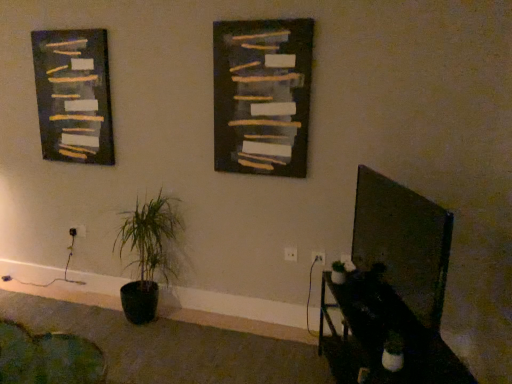
Question: From the image's perspective, is white plastic electric outlet at lower left, the first electric outlet viewed from the left, positioned above or below green fabric swivel chair at lower left?

Choices:
 (A) above
 (B) below

Answer: (A)

Question: Considering the relative positions of white plastic electric outlet at lower left, the 3th electric outlet viewed from the front, and green fabric swivel chair at lower left in the image provided, is white plastic electric outlet at lower left, the 3th electric outlet viewed from the front, to the left or to the right of green fabric swivel chair at lower left?

Choices:
 (A) left
 (B) right

Answer: (A)

Question: Which object is the farthest from the green matte plant at lower left?

Choices:
 (A) dark matte board at center
 (B) white plastic electric outlet at lower center, the 1th electric outlet when ordered from right to left
 (C) black glossy table at lower right
 (D) white plastic electric outlet at center, which is counted as the 2th electric outlet, starting from the left
 (E) green fabric swivel chair at lower left

Answer: (C)

Question: Considering the real-world distances, which object is closest to the white plastic electric outlet at lower center, the third electric outlet from the back?

Choices:
 (A) green fabric swivel chair at lower left
 (B) white plastic electric outlet at lower left, which is counted as the third electric outlet, starting from the right
 (C) white plastic electric outlet at center, which is the second electric outlet from back to front
 (D) dark gray textured painting at left
 (E) green matte plant at lower left

Answer: (C)